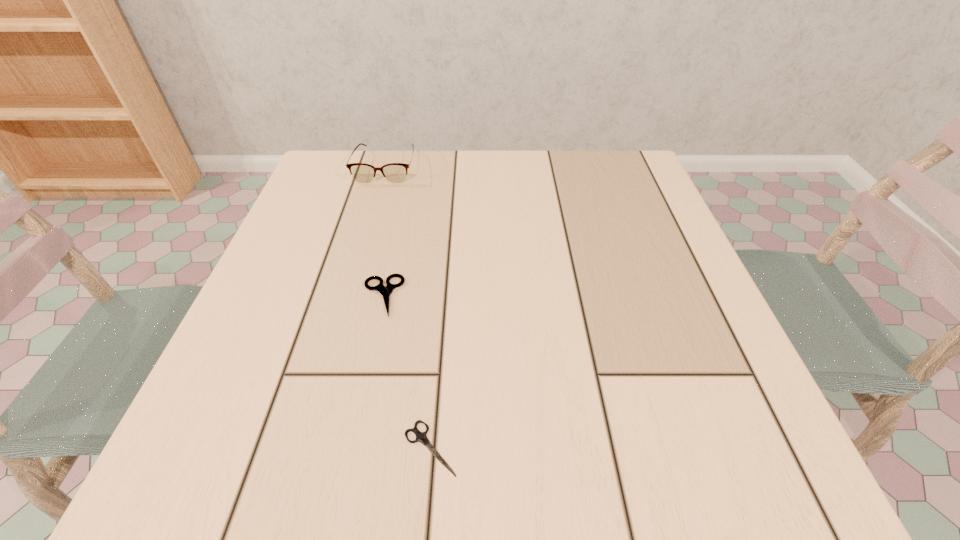
Find the location of a particular element. free point between the spectacles and the second nearest object is located at coordinates (384, 231).

This screenshot has width=960, height=540. In order to click on vacant space in between the shortest object and the spectacles in this screenshot , I will do `click(408, 307)`.

The width and height of the screenshot is (960, 540). I want to click on free space between the second shortest object and the tallest object, so click(x=384, y=231).

Locate an element on the screen. Image resolution: width=960 pixels, height=540 pixels. vacant region between the right shears and the second farthest object is located at coordinates click(406, 372).

Locate an element on the screen. free spot between the right shears and the tallest object is located at coordinates (408, 307).

This screenshot has height=540, width=960. What are the coordinates of `unoccupied area between the second farthest object and the spectacles` in the screenshot? It's located at (384, 231).

The image size is (960, 540). In order to click on free space that is in between the farther shears and the nearest object in this screenshot , I will do `click(406, 372)`.

Identify the location of free area in between the taller shears and the farthest object. (384, 231).

Locate an element on the screen. The image size is (960, 540). vacant space that is in between the spectacles and the rightmost object is located at coordinates (408, 307).

Find the location of a particular element. The image size is (960, 540). unoccupied position between the taller shears and the rightmost object is located at coordinates (406, 372).